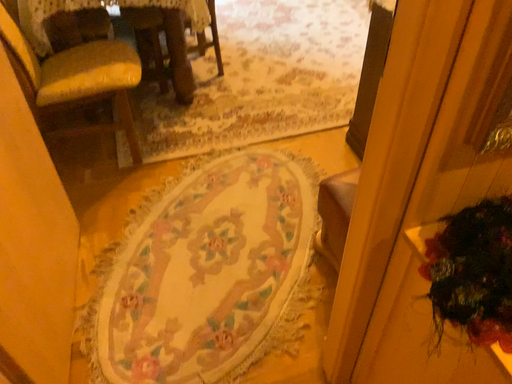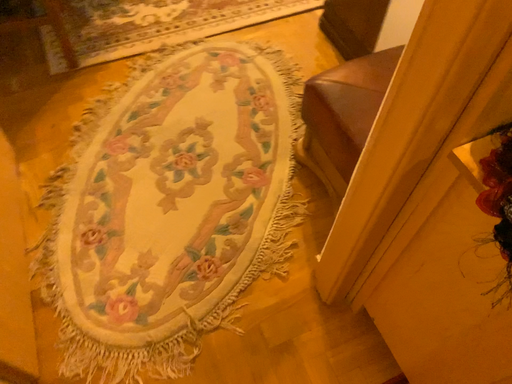
Question: Which way did the camera rotate in the video?

Choices:
 (A) rotated downward
 (B) rotated upward

Answer: (A)